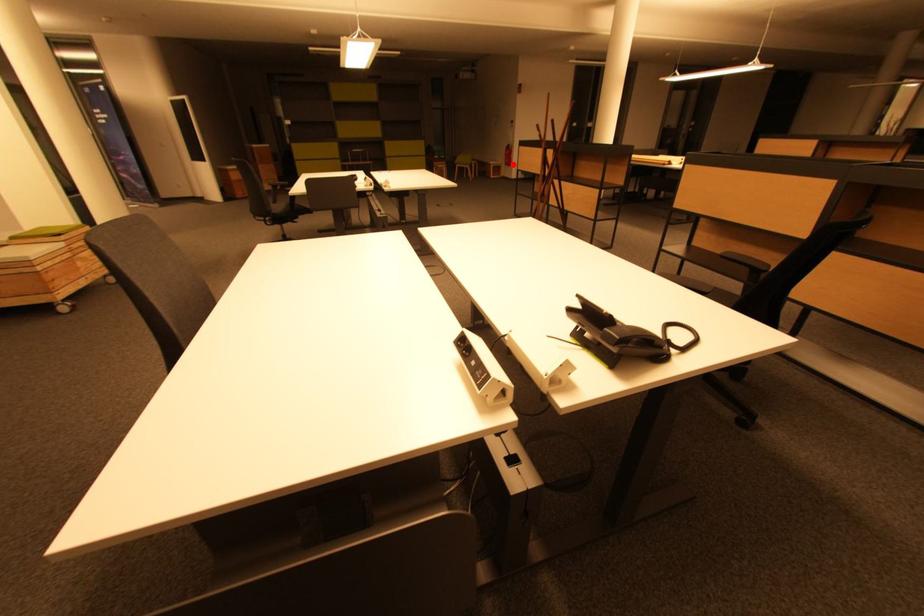
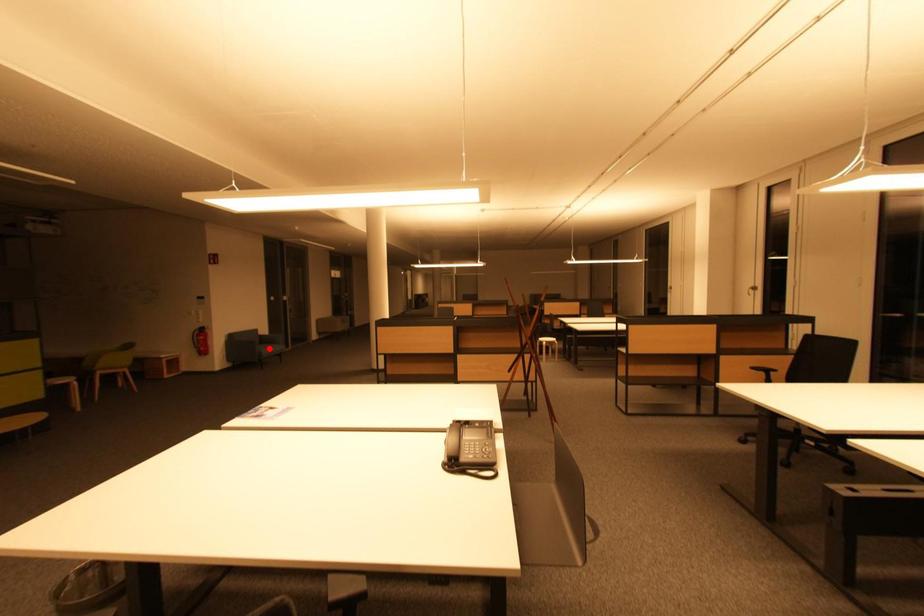
I am providing you with two images of the same scene from different viewpoints. A red point is marked on the first image and another point is marked on the second image. Does the point marked in image1 correspond to the same location as the one in image2?

No